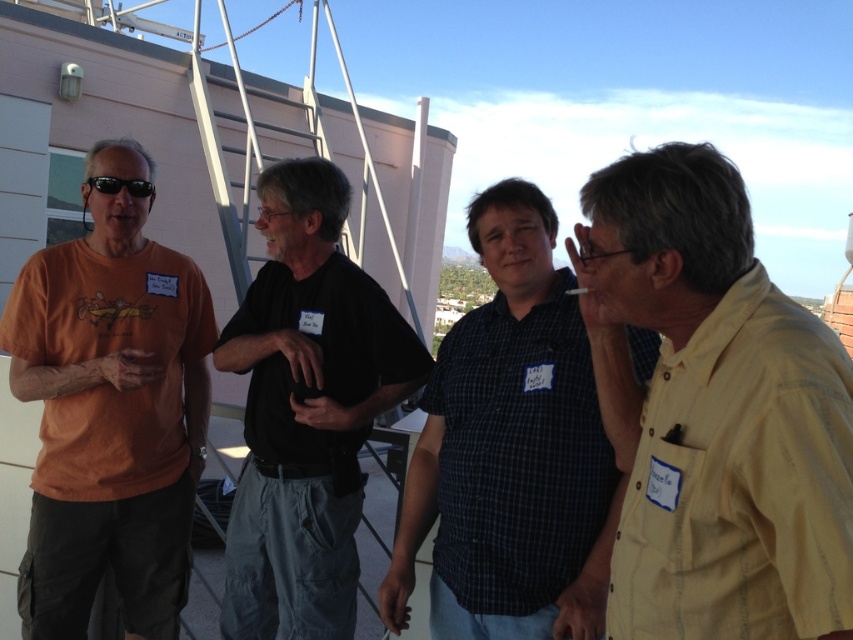
Looking at this image, is yellow cotton shirt at right closer to the viewer compared to black matte sunglasses at left?

Yes, yellow cotton shirt at right is in front of black matte sunglasses at left.

Between point (697, 572) and point (115, 179), which one is positioned behind?

Point (115, 179)

You are a GUI agent. You are given a task and a screenshot of the screen. Output one action in this format:
    pyautogui.click(x=<x>, y=<y>)
    Task: Click on the yellow cotton shirt at right
    Image resolution: width=853 pixels, height=640 pixels.
    Given the screenshot: What is the action you would take?
    pyautogui.click(x=712, y=412)

Does point (363, 307) lie behind point (103, 182)?

No, it is not.

I want to click on black cotton shirt at center, so click(x=306, y=410).

The height and width of the screenshot is (640, 853). What are the coordinates of `black cotton shirt at center` in the screenshot? It's located at (306, 410).

Between point (636, 288) and point (419, 467), which one is positioned in front?

Point (636, 288) is more forward.

Does yellow cotton shirt at right have a lesser width compared to dark blue checkered shirt at center?

Yes.

Who is more distant from viewer, (799, 369) or (552, 406)?

The point (552, 406) is behind.

The image size is (853, 640). I want to click on yellow cotton shirt at right, so click(712, 412).